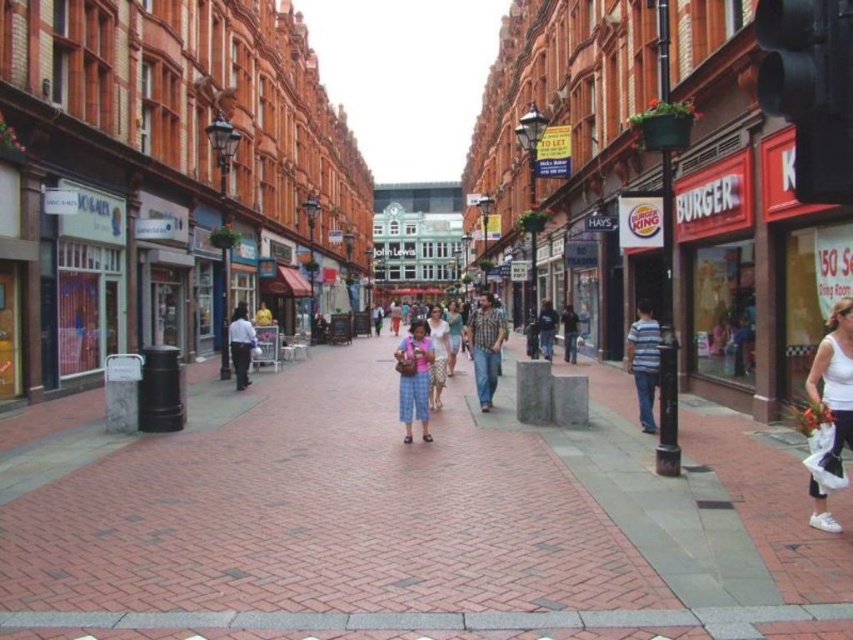
Question: Considering the relative positions of matte pink dress at center and dark blue jeans at center in the image provided, where is matte pink dress at center located with respect to dark blue jeans at center?

Choices:
 (A) above
 (B) below

Answer: (B)

Question: Which point is farther to the camera?

Choices:
 (A) (500, 417)
 (B) (405, 344)
 (C) (572, 320)

Answer: (C)

Question: Which point is farther to the camera?

Choices:
 (A) (809, 481)
 (B) (82, 452)

Answer: (B)

Question: Is striped cotton shirt at right to the left of matte pink dress at center from the viewer's perspective?

Choices:
 (A) yes
 (B) no

Answer: (B)

Question: Can you confirm if brick pavement at center is bigger than light blue jeans at center?

Choices:
 (A) yes
 (B) no

Answer: (A)

Question: Which point is closer to the camera?

Choices:
 (A) (544, 323)
 (B) (421, 332)
 (C) (247, 355)

Answer: (B)